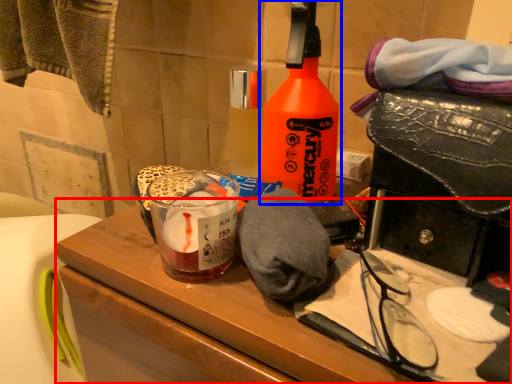
Question: Among these objects, which one is farthest to the camera, vanity (highlighted by a red box) or bottle (highlighted by a blue box)?

Choices:
 (A) vanity
 (B) bottle

Answer: (B)